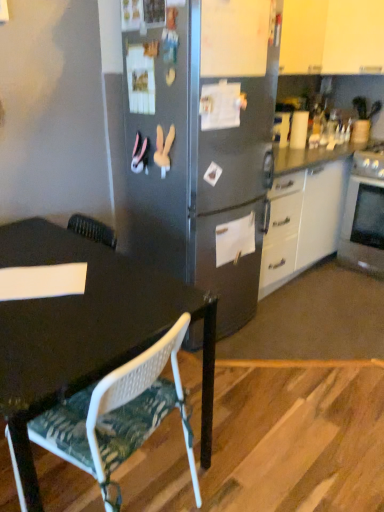
Where is `white matte cabinet at upper right`? white matte cabinet at upper right is located at coordinates (332, 35).

What is the approximate height of white mesh chair at lower left?

It is 7.96 inches.

Describe the element at coordinates (364, 214) in the screenshot. I see `silver metallic oven at right` at that location.

Where is `white matte cabinet at upper right`? The image size is (384, 512). white matte cabinet at upper right is located at coordinates (332, 35).

Find the location of a particular element. oven behind the white mesh chair at lower left is located at coordinates (364, 214).

Is white mesh chair at lower left at the left side of silver metallic oven at right?

Yes, white mesh chair at lower left is to the left of silver metallic oven at right.

Which is farther from the camera, (184, 439) or (365, 261)?

The point (365, 261) is more distant.

Which of these two, white mesh chair at lower left or silver metallic oven at right, stands taller?

silver metallic oven at right is taller.

Where is `cabinetry on the left side of silver metallic oven at right`? The height and width of the screenshot is (512, 384). cabinetry on the left side of silver metallic oven at right is located at coordinates (332, 35).

What's the angular difference between silver metallic oven at right and white matte cabinet at upper right's facing directions?

The facing directions of silver metallic oven at right and white matte cabinet at upper right are 0.948 degrees apart.

Is silver metallic oven at right in front of or behind white matte cabinet at upper right in the image?

silver metallic oven at right is behind white matte cabinet at upper right.

In terms of width, does white matte cabinet at upper right look wider or thinner when compared to white mesh chair at lower left?

Clearly, white matte cabinet at upper right has more width compared to white mesh chair at lower left.

Is the position of white matte cabinet at upper right more distant than that of white mesh chair at lower left?

That is True.

Is white matte cabinet at upper right inside or outside of white mesh chair at lower left?

white matte cabinet at upper right lies outside white mesh chair at lower left.

Between white mesh chair at lower left and white matte cabinet at upper right, which one has smaller width?

white mesh chair at lower left is thinner.

Is white mesh chair at lower left positioned far away from white matte cabinet at upper right?

Yes, white mesh chair at lower left and white matte cabinet at upper right are quite far apart.

How much distance is there between white mesh chair at lower left and white matte cabinet at upper right?

A distance of 7.37 feet exists between white mesh chair at lower left and white matte cabinet at upper right.

From a real-world perspective, which object rests below the other?

white mesh chair at lower left, from a real-world perspective.

Locate an element on the screen. Image resolution: width=384 pixels, height=512 pixels. oven below the white matte cabinet at upper right (from the image's perspective) is located at coordinates (364, 214).

Would you say white matte cabinet at upper right is outside silver metallic oven at right?

Yes, white matte cabinet at upper right is located beyond the bounds of silver metallic oven at right.

Consider the image. Is white matte cabinet at upper right wider or thinner than silver metallic oven at right?

Considering their sizes, white matte cabinet at upper right looks slimmer than silver metallic oven at right.

From a real-world perspective, who is located higher, white matte cabinet at upper right or silver metallic oven at right?

From a 3D spatial view, white matte cabinet at upper right is above.

Looking at this image, considering the sizes of objects silver metallic oven at right and white mesh chair at lower left in the image provided, who is thinner, silver metallic oven at right or white mesh chair at lower left?

white mesh chair at lower left.

Is silver metallic oven at right oriented away from white mesh chair at lower left?

No.

How many degrees apart are the facing directions of silver metallic oven at right and white mesh chair at lower left?

The facing directions of silver metallic oven at right and white mesh chair at lower left are 79.6 degrees apart.

Considering the sizes of silver metallic oven at right and white mesh chair at lower left in the image, is silver metallic oven at right taller or shorter than white mesh chair at lower left?

In the image, silver metallic oven at right appears to be taller than white mesh chair at lower left.

Identify the location of chair in front of the silver metallic oven at right. This screenshot has height=512, width=384. (119, 416).

The height and width of the screenshot is (512, 384). I want to click on oven behind the white matte cabinet at upper right, so click(364, 214).

Which object lies further to the anchor point white mesh chair at lower left, white matte cabinet at upper right or silver metallic oven at right?

Based on the image, white matte cabinet at upper right appears to be further to white mesh chair at lower left.

Based on the photo, based on their spatial positions, is white mesh chair at lower left or silver metallic oven at right closer to white matte cabinet at upper right?

silver metallic oven at right.

Which object lies nearer to the anchor point silver metallic oven at right, white mesh chair at lower left or white matte cabinet at upper right?

white matte cabinet at upper right is closer to silver metallic oven at right.

From the image, which object appears to be farther from white matte cabinet at upper right, silver metallic oven at right or white mesh chair at lower left?

Among the two, white mesh chair at lower left is located further to white matte cabinet at upper right.

Based on their spatial positions, is silver metallic oven at right or white matte cabinet at upper right further from white mesh chair at lower left?

Among the two, white matte cabinet at upper right is located further to white mesh chair at lower left.

When comparing their distances from silver metallic oven at right, does white matte cabinet at upper right or white mesh chair at lower left seem closer?

The object closer to silver metallic oven at right is white matte cabinet at upper right.

Identify the location of oven between white matte cabinet at upper right and white mesh chair at lower left in the vertical direction. (364, 214).